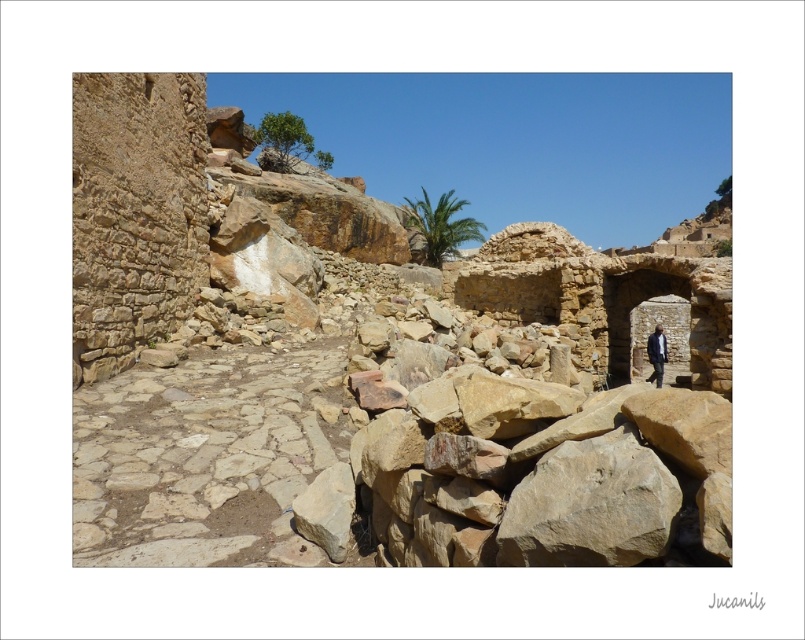
You are standing at the entrance of the ancient stone structure and notice the brown stone ruins at center and the dark blue suit at right. Which object is taller?

The brown stone ruins at center is much taller than the dark blue suit at right.

You are a tourist standing at the entrance of the ancient stone structure. You see the brown stone ruins at center and the green leafy palm at center. Which object is closer to you?

The brown stone ruins at center is closer to the viewer than the green leafy palm at center.

You are a tourist wearing a dark blue suit at right visiting the ancient stone structure. You want to take a photo of the green leafy palm at center. To make the palm appear bigger in your photo, should you move closer to or farther away from the palm?

To make the green leafy palm at center appear bigger in your photo, you should move closer to it. Since the palm is already larger in size compared to the dark blue suit at right, moving closer will magnify its size in the frame.